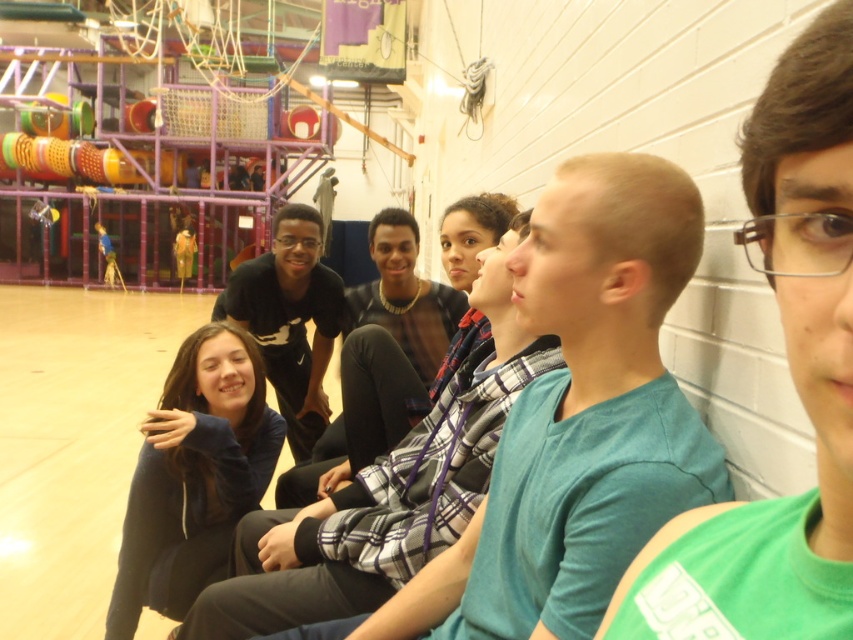
Question: Observing the image, what is the correct spatial positioning of green fabric shirt at right in reference to dark blue hoodie at center?

Choices:
 (A) below
 (B) above

Answer: (B)

Question: Which point is closer to the camera?

Choices:
 (A) (764, 621)
 (B) (544, 493)
 (C) (149, 442)

Answer: (A)

Question: Which point appears closest to the camera in this image?

Choices:
 (A) (113, 609)
 (B) (527, 477)
 (C) (772, 500)

Answer: (C)

Question: Does green fabric shirt at right appear on the right side of dark blue hoodie at center?

Choices:
 (A) yes
 (B) no

Answer: (A)

Question: Does teal cotton shirt at center have a smaller size compared to green fabric shirt at right?

Choices:
 (A) yes
 (B) no

Answer: (B)

Question: Which of the following is the closest to the observer?

Choices:
 (A) teal cotton shirt at center
 (B) dark blue hoodie at center
 (C) green fabric shirt at right

Answer: (C)